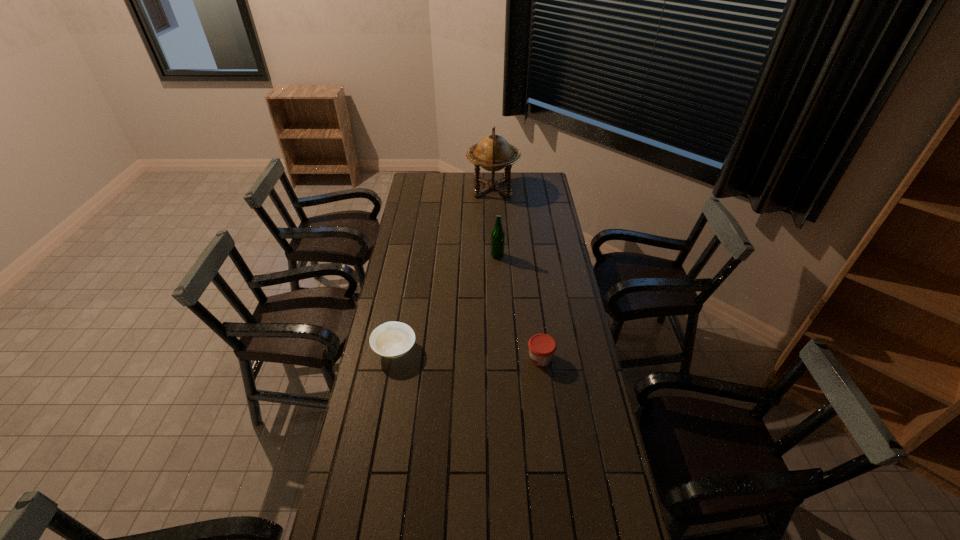
This screenshot has width=960, height=540. I want to click on vacant area situated on the label of the second farthest object, so click(449, 256).

Locate an element on the screen. The width and height of the screenshot is (960, 540). vacant area situated on the label of the second farthest object is located at coordinates (469, 256).

You are a GUI agent. You are given a task and a screenshot of the screen. Output one action in this format:
    pyautogui.click(x=<x>, y=<y>)
    Task: Click on the vacant space situated on the label of the second farthest object
    This screenshot has width=960, height=540.
    Given the screenshot: What is the action you would take?
    pyautogui.click(x=474, y=256)

I want to click on free location located 0.120m on the front label of the third tallest object, so click(495, 358).

This screenshot has height=540, width=960. Find the location of `vacant space located 0.340m on the front label of the third tallest object`. vacant space located 0.340m on the front label of the third tallest object is located at coordinates (437, 358).

You are a GUI agent. You are given a task and a screenshot of the screen. Output one action in this format:
    pyautogui.click(x=<x>, y=<y>)
    Task: Click on the vacant area situated 0.160m on the front label of the third tallest object
    This screenshot has width=960, height=540.
    Given the screenshot: What is the action you would take?
    pyautogui.click(x=485, y=358)

This screenshot has height=540, width=960. Identify the location of vacant space positioned 0.270m on the right of the leftmost object. (487, 349).

You are a GUI agent. You are given a task and a screenshot of the screen. Output one action in this format:
    pyautogui.click(x=<x>, y=<y>)
    Task: Click on the object that is at the far edge
    The height and width of the screenshot is (540, 960).
    Given the screenshot: What is the action you would take?
    pyautogui.click(x=493, y=153)

Where is `object located in the left edge section of the desktop`? The image size is (960, 540). object located in the left edge section of the desktop is located at coordinates (392, 339).

Find the location of a particular element. The image size is (960, 540). object that is at the right edge is located at coordinates (541, 346).